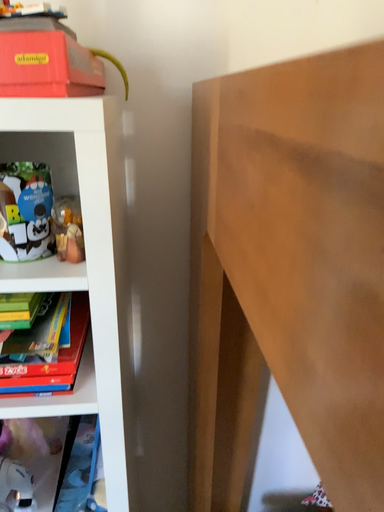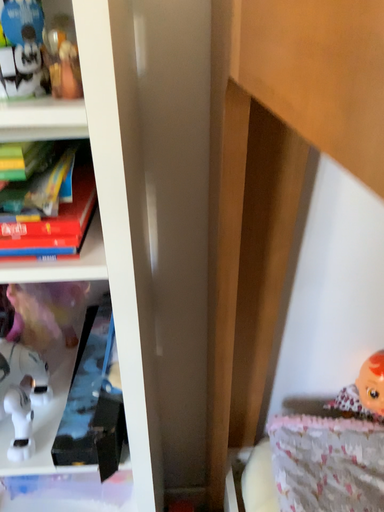
Question: How did the camera likely rotate when shooting the video?

Choices:
 (A) rotated downward
 (B) rotated upward

Answer: (A)